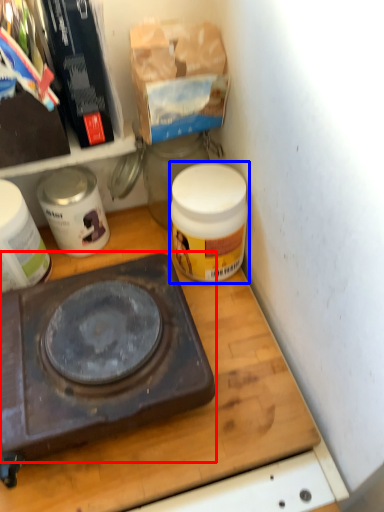
Question: Which object appears farthest to the camera in this image, gas stove (highlighted by a red box) or product (highlighted by a blue box)?

Choices:
 (A) gas stove
 (B) product

Answer: (B)